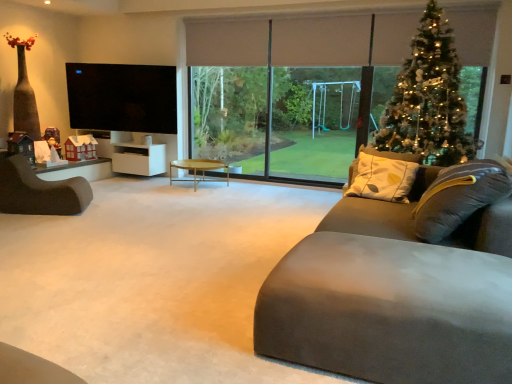
Question: Is suede-like gray couch at lower right located outside white matte cabinet at left?

Choices:
 (A) no
 (B) yes

Answer: (B)

Question: Does suede-like gray couch at lower right appear on the right side of white matte cabinet at left?

Choices:
 (A) no
 (B) yes

Answer: (B)

Question: Is white matte cabinet at left at the back of suede-like gray couch at lower right?

Choices:
 (A) yes
 (B) no

Answer: (B)

Question: Is suede-like gray couch at lower right taller than white matte cabinet at left?

Choices:
 (A) yes
 (B) no

Answer: (B)

Question: Is suede-like gray couch at lower right in contact with white matte cabinet at left?

Choices:
 (A) yes
 (B) no

Answer: (B)

Question: From the image's perspective, relative to dark brown leather chair at left, is iridescent metallic christmas tree at upper right above or below?

Choices:
 (A) below
 (B) above

Answer: (B)

Question: In terms of width, does iridescent metallic christmas tree at upper right look wider or thinner when compared to dark brown leather chair at left?

Choices:
 (A) wide
 (B) thin

Answer: (B)

Question: From their relative heights in the image, would you say iridescent metallic christmas tree at upper right is taller or shorter than dark brown leather chair at left?

Choices:
 (A) short
 (B) tall

Answer: (B)

Question: Is iridescent metallic christmas tree at upper right in front of or behind dark brown leather chair at left in the image?

Choices:
 (A) front
 (B) behind

Answer: (B)

Question: Looking at their shapes, would you say wooden round coffee table at center is wider or thinner than suede couch at lower right?

Choices:
 (A) wide
 (B) thin

Answer: (B)

Question: Considering the relative positions of wooden round coffee table at center and suede couch at lower right in the image provided, is wooden round coffee table at center to the left or to the right of suede couch at lower right?

Choices:
 (A) right
 (B) left

Answer: (A)

Question: Based on their sizes in the image, would you say wooden round coffee table at center is bigger or smaller than suede couch at lower right?

Choices:
 (A) small
 (B) big

Answer: (A)

Question: From the image's perspective, is wooden round coffee table at center above or below suede couch at lower right?

Choices:
 (A) below
 (B) above

Answer: (B)

Question: Is transparent glass window at center spatially inside dark brown leather chair at left, or outside of it?

Choices:
 (A) outside
 (B) inside

Answer: (A)

Question: From the image's perspective, is transparent glass window at center above or below dark brown leather chair at left?

Choices:
 (A) below
 (B) above

Answer: (B)